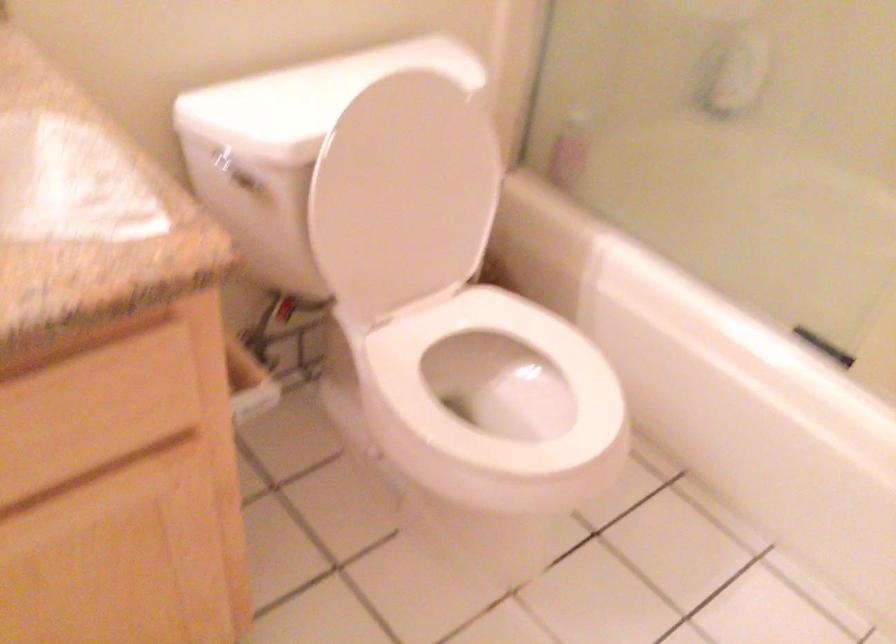
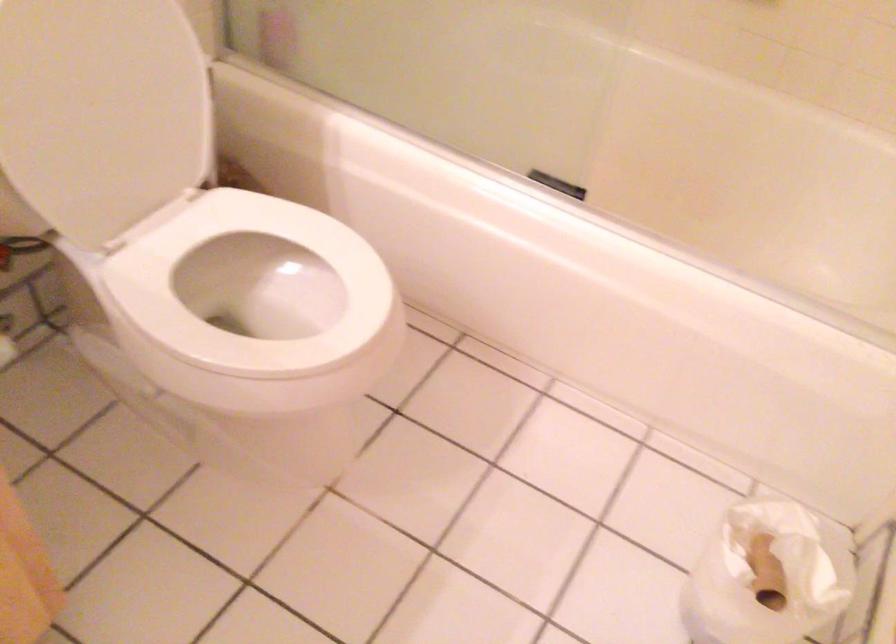
Question: The camera is either moving clockwise (left) or counter-clockwise (right) around the object. The first image is from the beginning of the video and the second image is from the end. Is the camera moving left or right when shooting the video?

Choices:
 (A) Left
 (B) Right

Answer: (A)